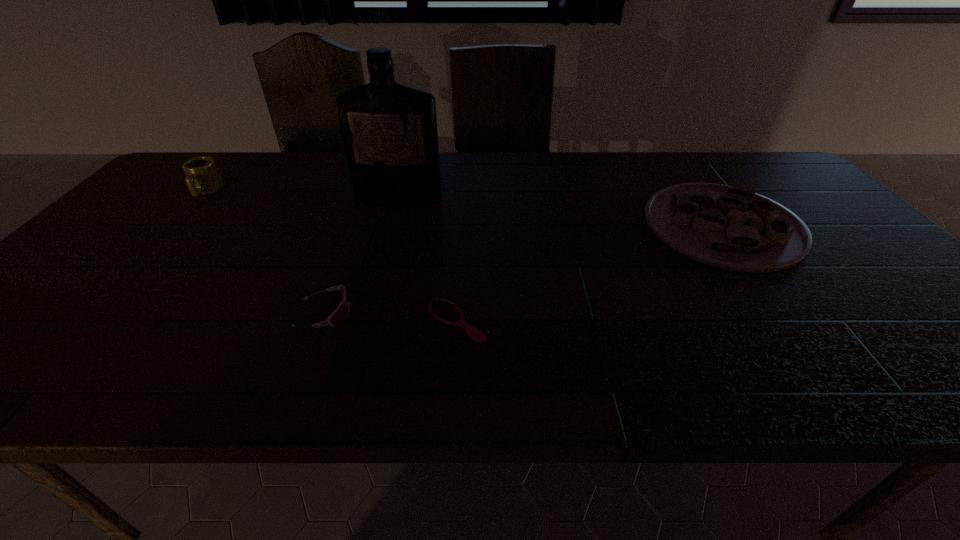
Find the location of a particular element. This screenshot has width=960, height=540. vacant region located 0.120m on the right of the platter is located at coordinates (843, 226).

The height and width of the screenshot is (540, 960). I want to click on free region located on the front-facing side of the goggles, so click(417, 313).

Locate an element on the screen. free location located on the back of the hairbrush is located at coordinates pos(461,241).

Find the location of a particular element. The height and width of the screenshot is (540, 960). object situated at the far edge is located at coordinates (202, 175).

The image size is (960, 540). I want to click on object at the left edge, so click(202, 175).

Where is `object that is at the right edge`? The width and height of the screenshot is (960, 540). object that is at the right edge is located at coordinates (733, 228).

Identify the location of object that is positioned at the far left corner. (202, 175).

Where is `vacant space at the far edge of the desktop`? This screenshot has width=960, height=540. vacant space at the far edge of the desktop is located at coordinates (486, 173).

The image size is (960, 540). In order to click on vacant space at the left edge in this screenshot , I will do `click(180, 219)`.

I want to click on free space at the right edge of the desktop, so click(883, 277).